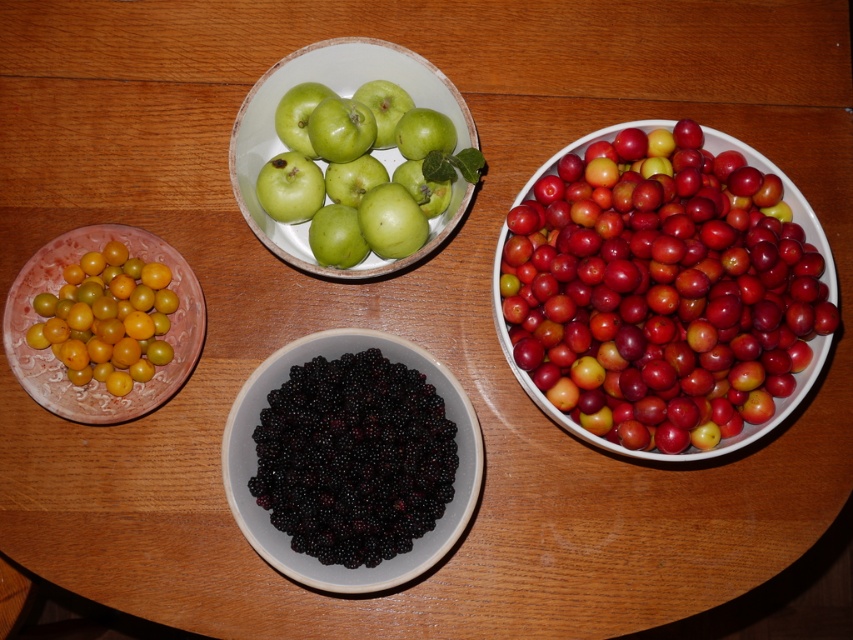
What do you see at coordinates (354, 172) in the screenshot? This screenshot has width=853, height=640. I see `green matte apples at center` at bounding box center [354, 172].

Identify the location of green matte apples at center. coord(354,172).

You are a GUI agent. You are given a task and a screenshot of the screen. Output one action in this format:
    pyautogui.click(x=<x>, y=<y>)
    Task: Click on the green matte apples at center
    This screenshot has width=853, height=640.
    Given the screenshot: What is the action you would take?
    pyautogui.click(x=354, y=172)

What do you see at coordinates (656, 296) in the screenshot? The height and width of the screenshot is (640, 853). I see `glossy red cherry at right` at bounding box center [656, 296].

Between point (521, 208) and point (401, 349), which one is positioned behind?

The point (401, 349) is more distant.

At what (x,y) coordinates should I click in order to perform the action: click on glossy red cherry at right. Please return your answer as a coordinate pair (x, y). The height and width of the screenshot is (640, 853). Looking at the image, I should click on (656, 296).

Between point (575, 420) and point (445, 116), which one is positioned behind?

Positioned behind is point (445, 116).

Is glossy red cherry at right positioned at the back of green matte apples at center?

No, it is not.

Is point (592, 365) positioned before point (370, 177)?

Yes, it is in front of point (370, 177).

Find the location of a particular element. The width and height of the screenshot is (853, 640). glossy red cherry at right is located at coordinates (656, 296).